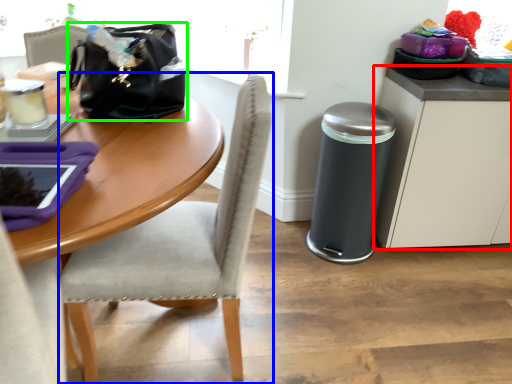
Question: Which object is positioned closest to cabinetry (highlighted by a red box)? Select from chair (highlighted by a blue box) and handbag (highlighted by a green box).

Choices:
 (A) chair
 (B) handbag

Answer: (A)